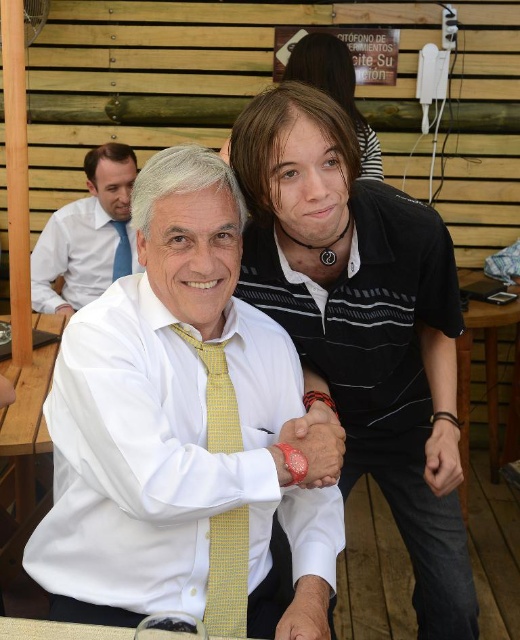
Does white matte shirt at center have a lesser height compared to striped polo shirt at upper center?

In fact, white matte shirt at center may be taller than striped polo shirt at upper center.

Does white matte shirt at center appear on the right side of striped polo shirt at upper center?

No, white matte shirt at center is not to the right of striped polo shirt at upper center.

This screenshot has height=640, width=520. Find the location of `white matte shirt at center`. white matte shirt at center is located at coordinates (180, 428).

Measure the distance between point (235, 608) and camera.

Point (235, 608) is 3.87 feet from camera.

Where is `yellow woven tie at center`? yellow woven tie at center is located at coordinates (227, 573).

Who is higher up, white shirt at upper left or yellow woven tie at center?

white shirt at upper left is above.

Is the position of white shirt at upper left less distant than that of yellow woven tie at center?

No, it is behind yellow woven tie at center.

Which is behind, point (60, 301) or point (203, 616)?

The point (60, 301) is more distant.

I want to click on white shirt at upper left, so click(x=87, y=236).